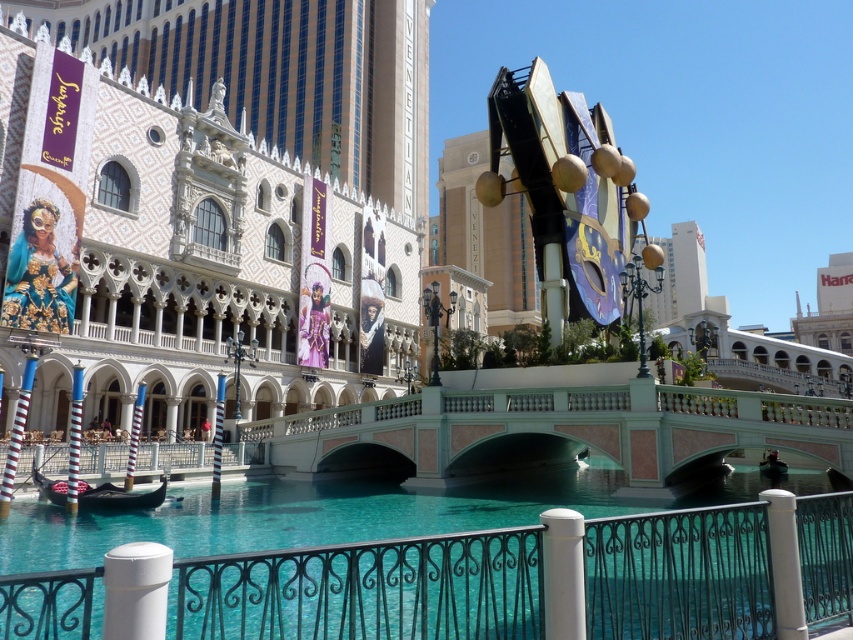
You are planning to take a photo of the polished stone bridge at center and the wooden gondola at lower left. Which object should you focus on first if you want to capture both in a single frame without moving the camera?

The polished stone bridge at center is bigger than the wooden gondola at lower left, so you should focus on the polished stone bridge at center first to ensure it fits properly in the frame.